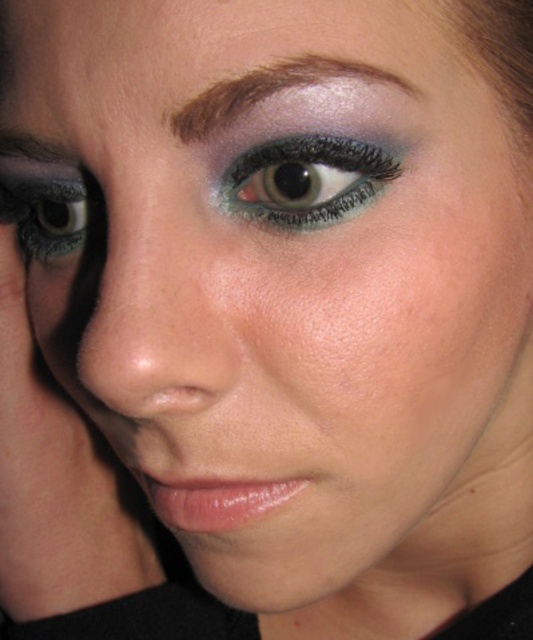
Is matte teal eye at upper left further to camera compared to shiny teal eye at center?

No, it is in front of shiny teal eye at center.

Find the location of `matte teal eye at upper left`. matte teal eye at upper left is located at coordinates (303, 180).

At what (x,y) coordinates should I click in order to perform the action: click on matte teal eye at upper left. Please return your answer as a coordinate pair (x, y). Image resolution: width=533 pixels, height=640 pixels. Looking at the image, I should click on (303, 180).

Who is higher up, shiny teal eye at center or matte black eye at left?

shiny teal eye at center is higher up.

Measure the distance between shiny teal eye at center and camera.

shiny teal eye at center and camera are 9.46 inches apart from each other.

Who is more distant from viewer, (x=399, y=163) or (x=78, y=236)?

The point (x=78, y=236) is more distant.

Where is `shiny teal eye at center`? Image resolution: width=533 pixels, height=640 pixels. shiny teal eye at center is located at coordinates (305, 179).

Which is below, matte black eye at left or shiny brown eyebrow at upper center?

matte black eye at left is below.

Is matte black eye at left closer to the viewer compared to shiny brown eyebrow at upper center?

No.

Find the location of a particular element. This screenshot has height=640, width=533. matte black eye at left is located at coordinates (44, 205).